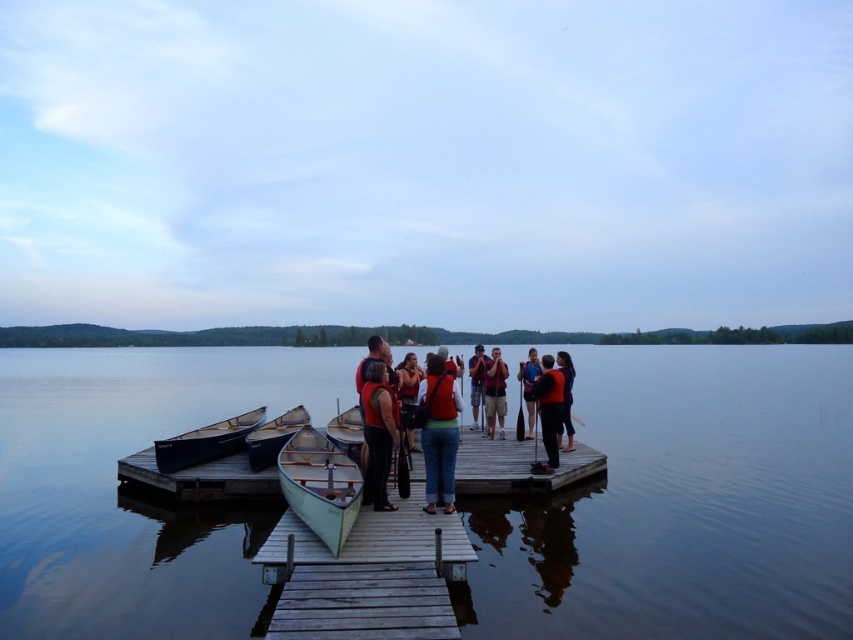
Is matte black jacket at center thinner than blue fabric shirt at center?

No, matte black jacket at center is not thinner than blue fabric shirt at center.

What do you see at coordinates (549, 410) in the screenshot? I see `matte black jacket at center` at bounding box center [549, 410].

You are a GUI agent. You are given a task and a screenshot of the screen. Output one action in this format:
    pyautogui.click(x=<x>, y=<y>)
    Task: Click on the matte black jacket at center
    This screenshot has width=853, height=640.
    Given the screenshot: What is the action you would take?
    pyautogui.click(x=549, y=410)

Can you confirm if orange life vest at center is thinner than matte black jacket at right?

No, orange life vest at center is not thinner than matte black jacket at right.

Is orange life vest at center taller than matte black jacket at right?

Correct, orange life vest at center is much taller as matte black jacket at right.

I want to click on orange life vest at center, so click(408, 392).

Who is positioned more to the left, smooth water at dock center or matte black jacket at right?

From the viewer's perspective, smooth water at dock center appears more on the left side.

Can you confirm if smooth water at dock center is bigger than matte black jacket at right?

Yes, smooth water at dock center is bigger than matte black jacket at right.

You are a GUI agent. You are given a task and a screenshot of the screen. Output one action in this format:
    pyautogui.click(x=<x>, y=<y>)
    Task: Click on the smooth water at dock center
    
    Given the screenshot: What is the action you would take?
    pyautogui.click(x=683, y=506)

Where is `smooth water at dock center`? The image size is (853, 640). smooth water at dock center is located at coordinates (683, 506).